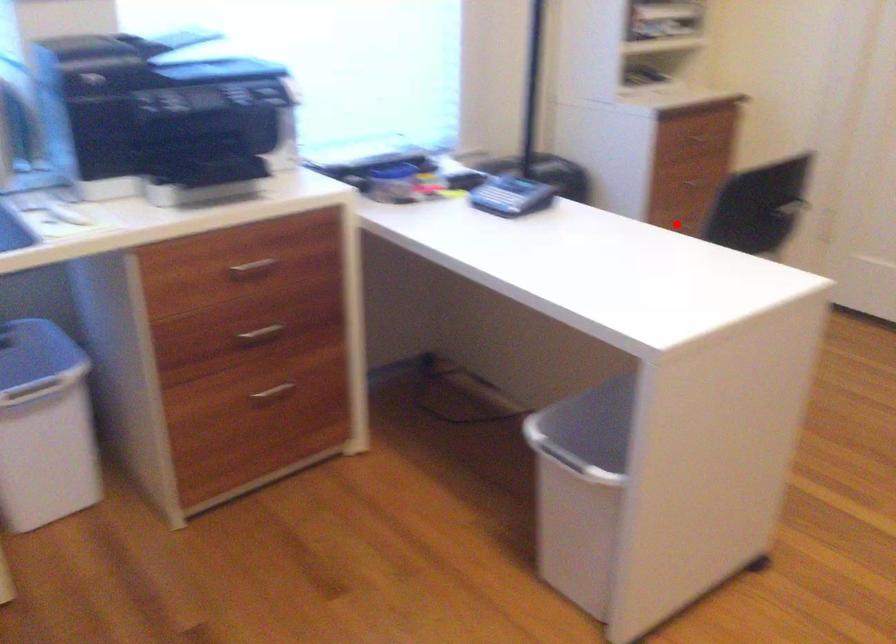
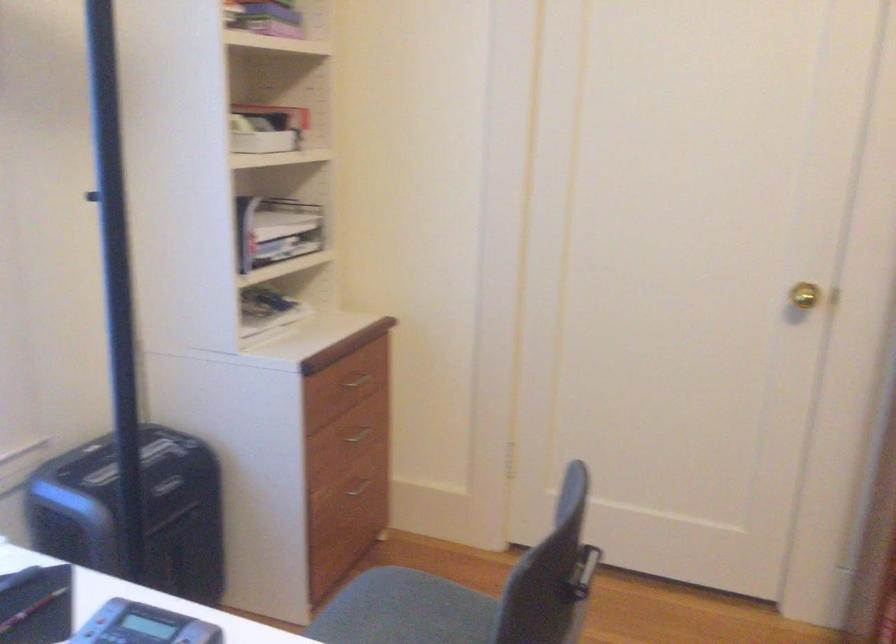
In the second image, find the point that corresponds to the highlighted location in the first image.

(359, 485)